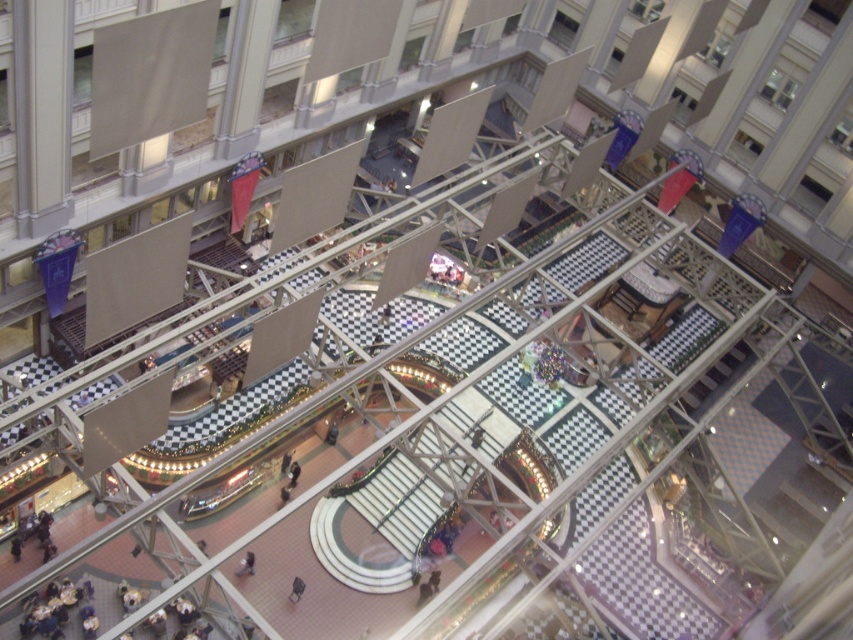
Question: Which point is closer to the camera taking this photo?

Choices:
 (A) (252, 563)
 (B) (293, 486)

Answer: (A)

Question: Does smooth beige coat at center have a larger size compared to dark gray fabric jacket at center?

Choices:
 (A) no
 (B) yes

Answer: (A)

Question: Observing the image, what is the correct spatial positioning of smooth beige coat at center in reference to dark gray fabric jacket at center?

Choices:
 (A) below
 (B) above

Answer: (A)

Question: Which object appears closest to the camera in this image?

Choices:
 (A) dark gray fabric jacket at center
 (B) smooth beige coat at center

Answer: (B)

Question: Does smooth beige coat at center have a smaller size compared to dark gray fabric jacket at center?

Choices:
 (A) no
 (B) yes

Answer: (B)